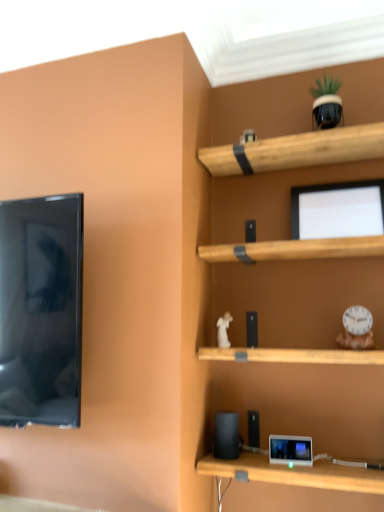
Question: From a real-world perspective, is matte black tablet at lower center positioned over black matte speaker at lower center based on gravity?

Choices:
 (A) yes
 (B) no

Answer: (B)

Question: From the image's perspective, does matte black tablet at lower center appear lower than black matte speaker at lower center?

Choices:
 (A) yes
 (B) no

Answer: (A)

Question: Can you confirm if matte black tablet at lower center is taller than black matte speaker at lower center?

Choices:
 (A) no
 (B) yes

Answer: (A)

Question: Is the position of matte black tablet at lower center more distant than that of black matte speaker at lower center?

Choices:
 (A) no
 (B) yes

Answer: (A)

Question: Is matte black tablet at lower center to the left of black matte speaker at lower center from the viewer's perspective?

Choices:
 (A) yes
 (B) no

Answer: (B)

Question: From the image's perspective, is matte black tablet at lower center over black matte speaker at lower center?

Choices:
 (A) yes
 (B) no

Answer: (B)

Question: Is white plastic clock at right, which is the first toy in right-to-left order, directly adjacent to matte black monitor at upper center?

Choices:
 (A) no
 (B) yes

Answer: (A)

Question: Considering the relative sizes of white plastic clock at right, which ranks as the second toy in top-to-bottom order, and matte black monitor at upper center in the image provided, is white plastic clock at right, which ranks as the second toy in top-to-bottom order, bigger than matte black monitor at upper center?

Choices:
 (A) no
 (B) yes

Answer: (A)

Question: Is there a large distance between white plastic clock at right, which ranks as the second toy in top-to-bottom order, and matte black monitor at upper center?

Choices:
 (A) no
 (B) yes

Answer: (A)

Question: From the image's perspective, is white plastic clock at right, which ranks as the second toy in top-to-bottom order, below matte black monitor at upper center?

Choices:
 (A) yes
 (B) no

Answer: (A)

Question: Considering the relative sizes of white plastic clock at right, which appears as the third toy when viewed from the left, and matte black monitor at upper center in the image provided, is white plastic clock at right, which appears as the third toy when viewed from the left, thinner than matte black monitor at upper center?

Choices:
 (A) yes
 (B) no

Answer: (A)

Question: From a real-world perspective, is white plastic clock at right, which is the first toy in right-to-left order, below matte black monitor at upper center?

Choices:
 (A) yes
 (B) no

Answer: (A)

Question: Is green matte plant pot at upper right, the 1th toy when ordered from top to bottom, taller than matte black tablet at lower center?

Choices:
 (A) no
 (B) yes

Answer: (B)